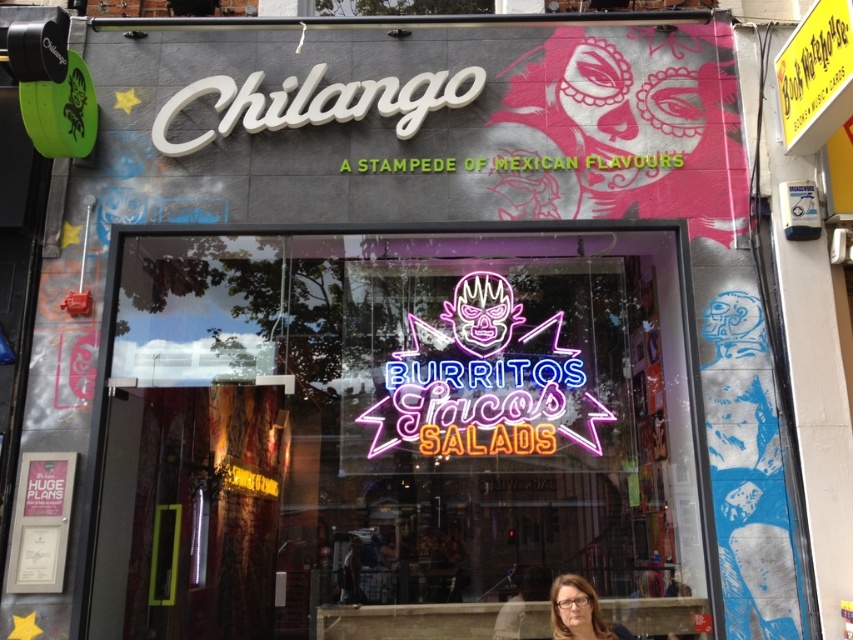
Question: Which object is positioned closest to the neon sign at center?

Choices:
 (A) matte brown hair at lower center
 (B) neontexturedsign at center

Answer: (B)

Question: Is the position of neontexturedsign at center more distant than that of matte brown hair at lower center?

Choices:
 (A) yes
 (B) no

Answer: (A)

Question: Is the position of neontexturedsign at center less distant than that of matte brown hair at lower center?

Choices:
 (A) no
 (B) yes

Answer: (A)

Question: Can you confirm if neon sign at center is bigger than matte brown hair at lower center?

Choices:
 (A) no
 (B) yes

Answer: (B)

Question: Which point is closer to the camera?

Choices:
 (A) matte brown hair at lower center
 (B) neontexturedsign at center

Answer: (A)

Question: Which object appears farthest from the camera in this image?

Choices:
 (A) matte brown hair at lower center
 (B) neontexturedsign at center

Answer: (B)